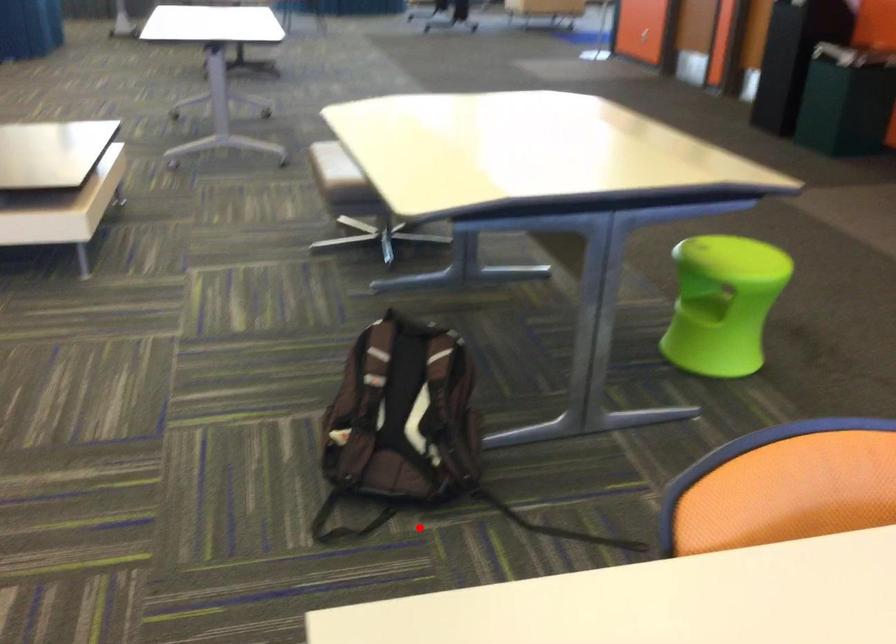
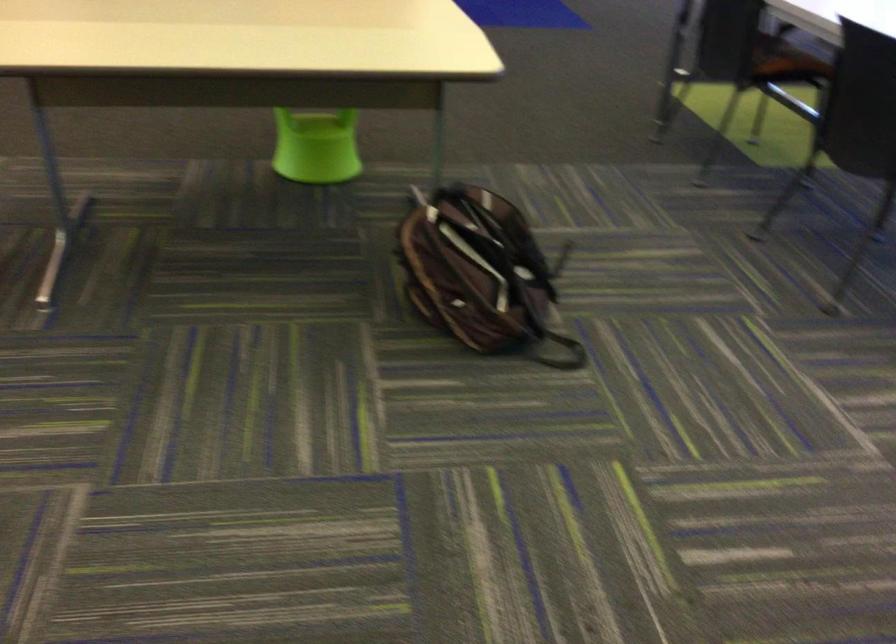
Question: I am providing you with two images of the same scene from different viewpoints. Image1 has a red point marked. In image2, the corresponding 3D location appears at what relative position? Reply with the corresponding letter.

Choices:
 (A) Closer
 (B) Farther

Answer: (B)